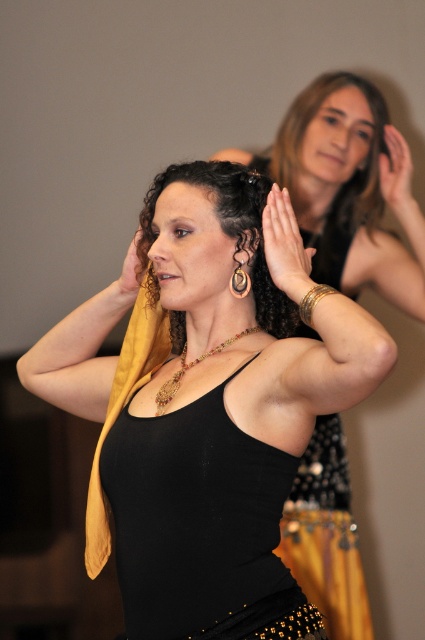
You are a costume designer preparing for a performance. You need to decide which accessory to place in the upper center of the costume. Given the golden metallic bracelet at upper center and the brown leather hair clip at upper center, which one takes up less space and is better suited for a minimalist design?

The golden metallic bracelet at upper center occupies less space than the brown leather hair clip at upper center, making it better suited for a minimalist design.

What is the exact coordinate of the golden metallic bracelet at upper center?

The golden metallic bracelet at upper center is located at point (286,246).

Looking at the golden metallic bracelet at upper center and the multicolored beaded necklace at center, which one is positioned more to the right?

The golden metallic bracelet at upper center is positioned more to the right than the multicolored beaded necklace at center.